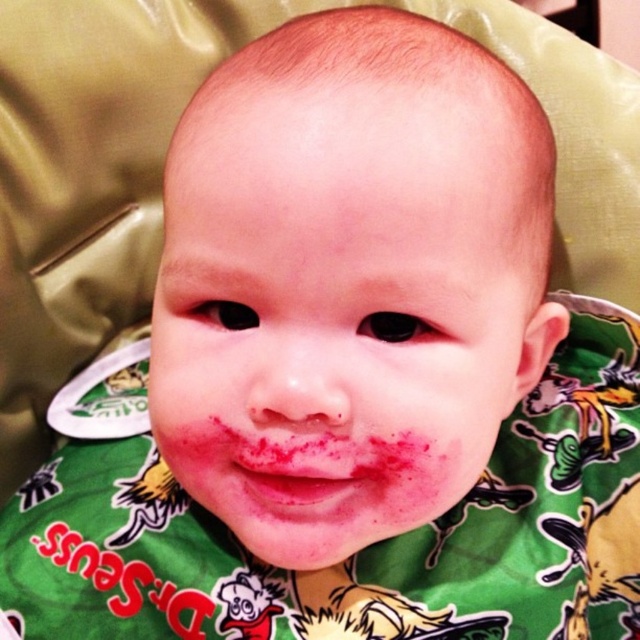
Between smooth skin face at center and pink matte lips at center, which one appears on the right side from the viewer's perspective?

Positioned to the right is smooth skin face at center.

Can you confirm if smooth skin face at center is bigger than pink matte lips at center?

Indeed, smooth skin face at center has a larger size compared to pink matte lips at center.

Is point (403, 136) in front of point (237, 493)?

Yes.

Locate an element on the screen. smooth skin face at center is located at coordinates (337, 316).